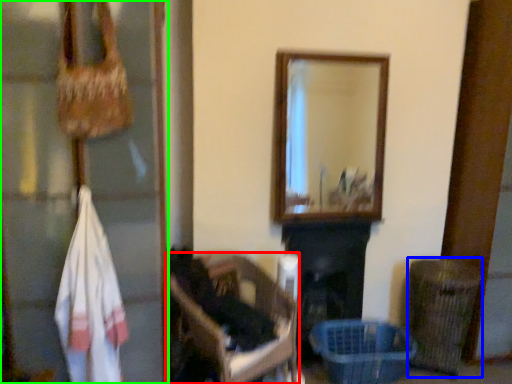
Question: Based on their relative distances, which object is nearer to furniture (highlighted by a red box)? Choose from shopping basket (highlighted by a blue box) and glass door (highlighted by a green box).

Choices:
 (A) shopping basket
 (B) glass door

Answer: (B)